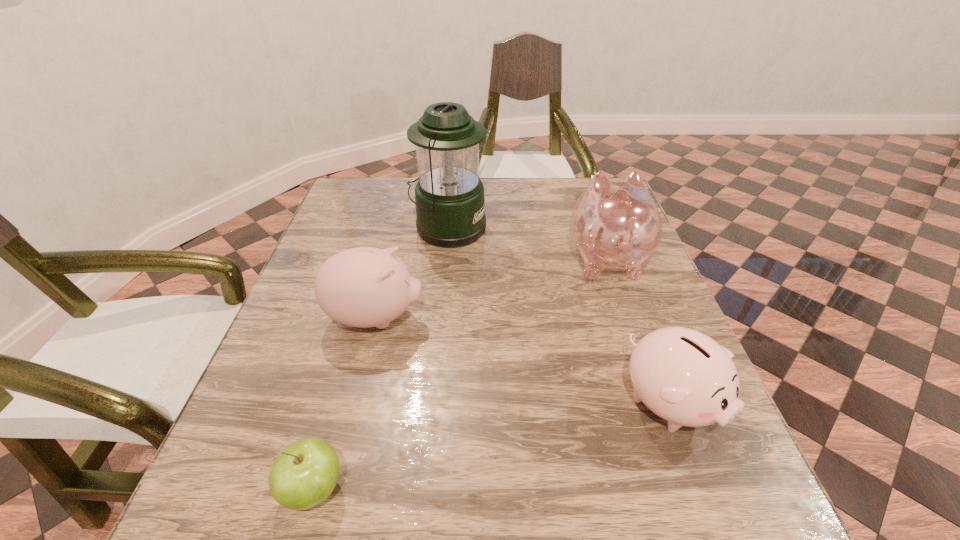
You are a GUI agent. You are given a task and a screenshot of the screen. Output one action in this format:
    pyautogui.click(x=<x>, y=<y>)
    Task: Click on the free space between the third nearest object and the lantern
    
    Given the screenshot: What is the action you would take?
    pyautogui.click(x=412, y=273)

The image size is (960, 540). Find the location of `vacant region between the nearest object and the lantern`. vacant region between the nearest object and the lantern is located at coordinates (381, 359).

In order to click on free space between the second tallest object and the leftmost piggy bank in this screenshot , I will do `click(492, 288)`.

The image size is (960, 540). Identify the location of blank region between the third farthest object and the nearest object. (345, 403).

Identify the location of free spot between the nearest piggy bank and the shortest object. The height and width of the screenshot is (540, 960). (492, 446).

In order to click on vacant space in between the farthest piggy bank and the lantern in this screenshot , I will do `click(527, 243)`.

Locate an element on the screen. The height and width of the screenshot is (540, 960). object that is the fourth closest to the second nearest object is located at coordinates (304, 474).

Locate an element on the screen. object that is the third nearest to the tallest piggy bank is located at coordinates (363, 287).

Identify which piggy bank is the second nearest to the fourth farthest object. Please provide its 2D coordinates. Your answer should be formatted as a tuple, i.e. [(x, y)], where the tuple contains the x and y coordinates of a point satisfying the conditions above.

[(363, 287)]

Identify which piggy bank is the nearest to the tallest object. Please provide its 2D coordinates. Your answer should be formatted as a tuple, i.e. [(x, y)], where the tuple contains the x and y coordinates of a point satisfying the conditions above.

[(363, 287)]